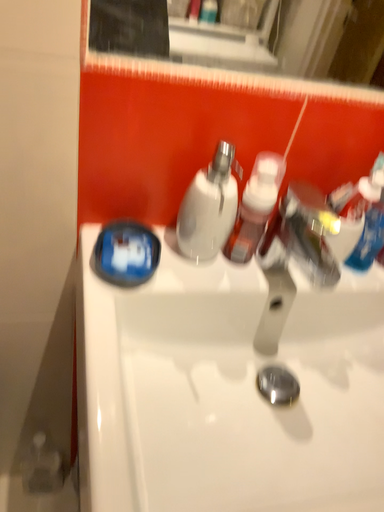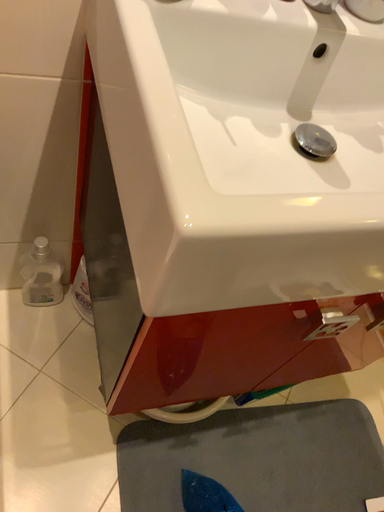
Question: How did the camera likely rotate when shooting the video?

Choices:
 (A) rotated upward
 (B) rotated downward

Answer: (B)